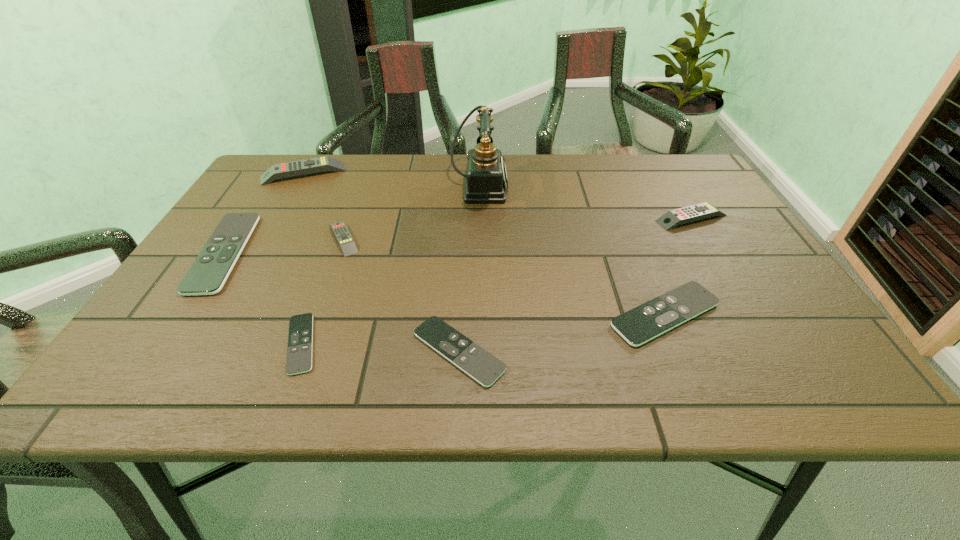
The image size is (960, 540). I want to click on black remote control that stands as the second closest to the fourth shortest object, so click(482, 366).

This screenshot has height=540, width=960. I want to click on black remote control that is the second closest to the third shortest remote control, so click(300, 338).

Image resolution: width=960 pixels, height=540 pixels. I want to click on vacant space that satisfies the following two spatial constraints: 1. on the front of the gray telephone at the rotary dial; 2. on the front side of the third black remote control from left to right, so click(x=479, y=351).

Locate an element on the screen. This screenshot has height=540, width=960. blank area in the image that satisfies the following two spatial constraints: 1. on the front side of the second black remote control from left to right; 2. on the right side of the farthest remote control is located at coordinates (206, 343).

This screenshot has height=540, width=960. In order to click on vacant area in the image that satisfies the following two spatial constraints: 1. on the back side of the rightmost black remote control; 2. on the front of the tallest object at the rotary dial in this screenshot , I will do `click(612, 186)`.